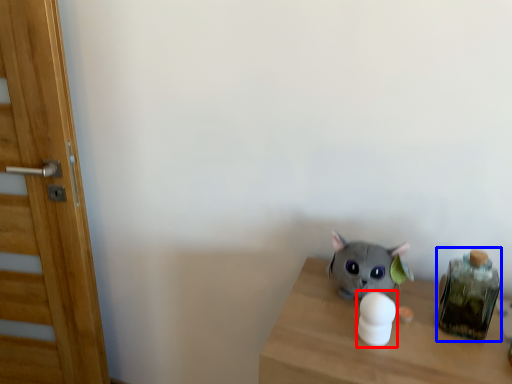
Question: Which of the following is the farthest to the observer, toy (highlighted by a red box) or glass jar (highlighted by a blue box)?

Choices:
 (A) toy
 (B) glass jar

Answer: (B)